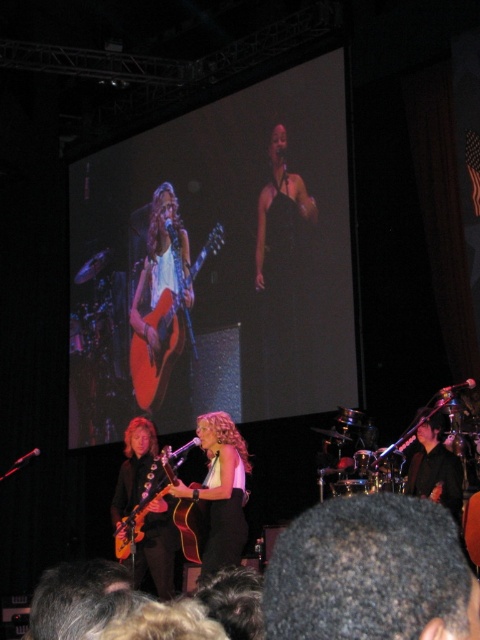
Who is more distant from viewer, (189, 486) or (456, 515)?

Positioned behind is point (189, 486).

The height and width of the screenshot is (640, 480). Describe the element at coordinates (220, 490) in the screenshot. I see `shiny gold guitar at center` at that location.

Is point (240, 532) positioned behind point (456, 522)?

Yes.

You are a GUI agent. You are given a task and a screenshot of the screen. Output one action in this format:
    pyautogui.click(x=<x>, y=<y>)
    Task: Click on the shiny gold guitar at center
    This screenshot has height=640, width=480.
    Given the screenshot: What is the action you would take?
    pyautogui.click(x=220, y=490)

Can you confirm if orange matte acoustic guitar at center is thinner than light brown wood guitar at center?

Incorrect, orange matte acoustic guitar at center's width is not less than light brown wood guitar at center's.

Can you confirm if orange matte acoustic guitar at center is positioned to the right of light brown wood guitar at center?

Indeed, orange matte acoustic guitar at center is positioned on the right side of light brown wood guitar at center.

Does point (144, 406) lie behind point (137, 525)?

Yes, point (144, 406) is farther from viewer.

I want to click on orange matte acoustic guitar at center, so click(166, 333).

Which is more to the right, dark curly hair at center or black leather jacket at center?

black leather jacket at center

Is dark curly hair at center in front of black leather jacket at center?

Yes, dark curly hair at center is in front of black leather jacket at center.

Does point (276, 595) lie in front of point (444, 460)?

Yes, it is.

Where is `dark curly hair at center`? dark curly hair at center is located at coordinates (371, 573).